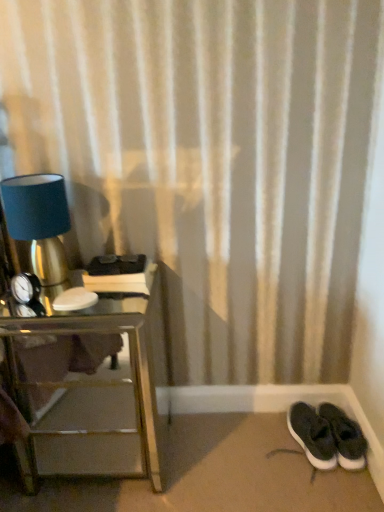
The height and width of the screenshot is (512, 384). I want to click on vacant space situated above matte blue lampshade at left (from a real-world perspective), so (39, 176).